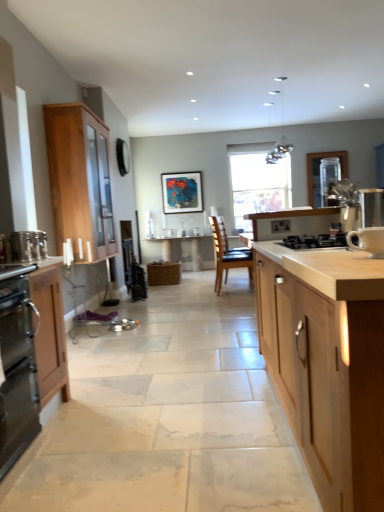
Question: Which is correct: wooden table at center is inside black matte gas stove at center, or outside of it?

Choices:
 (A) inside
 (B) outside

Answer: (B)

Question: From the image's perspective, is wooden table at center located above or below black matte gas stove at center?

Choices:
 (A) above
 (B) below

Answer: (B)

Question: Based on their relative distances, which object is nearer to the black matte gas stove at center?

Choices:
 (A) white ceramic mug at right, positioned as the first appliance in front-to-back order
 (B) stainless steel oven at left, which is the second cabinetry in front-to-back order
 (C) light wood cabinet at center, positioned as the first cabinetry in right-to-left order
 (D) wooden table at center
 (E) light wood cabinet at left, marked as the first cabinetry in a back-to-front arrangement

Answer: (A)

Question: Based on their relative distances, which object is nearer to the stainless steel oven at left, which is counted as the 2th cabinetry, starting from the left?

Choices:
 (A) transparent glass window at center
 (B) matte wood countertop at left
 (C) metallic glass pendant lights at upper center
 (D) metallic silver toaster at left, which ranks as the third appliance in right-to-left order
 (E) black matte gas stove at center

Answer: (B)